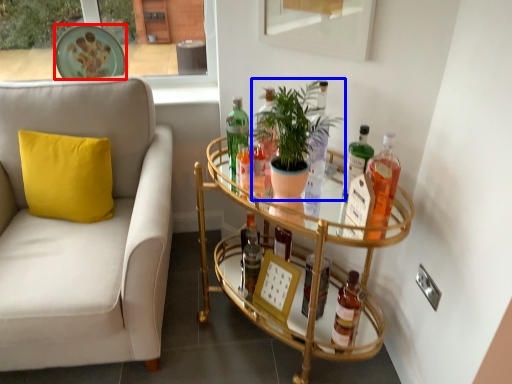
Question: Which point is closer to the camera, plate (highlighted by a red box) or houseplant (highlighted by a blue box)?

Choices:
 (A) plate
 (B) houseplant

Answer: (B)